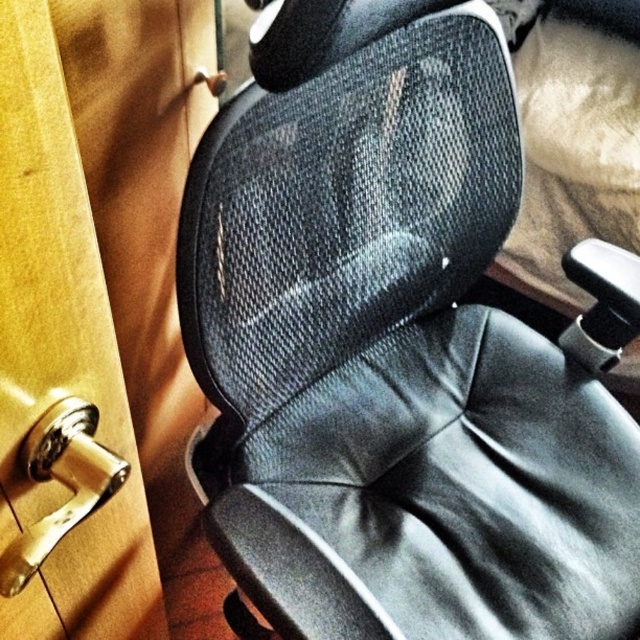
Question: Among these points, which one is farthest from the camera?

Choices:
 (A) (540, 476)
 (B) (38, 449)

Answer: (A)

Question: Is black mesh swivel chair at center smaller than polished brass door handle at lower left?

Choices:
 (A) yes
 (B) no

Answer: (B)

Question: Which point is farther to the camera?

Choices:
 (A) (52, 456)
 (B) (397, 362)

Answer: (B)

Question: In this image, where is black mesh swivel chair at center located relative to polished brass door handle at lower left?

Choices:
 (A) right
 (B) left

Answer: (A)

Question: Is black mesh swivel chair at center bigger than polished brass door handle at lower left?

Choices:
 (A) yes
 (B) no

Answer: (A)